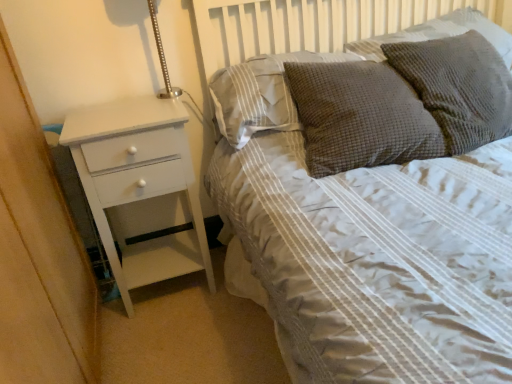
Question: Is brown textured pillow at upper right, which is the 3th pillow in right-to-left order, placed right next to white painted wood chest of drawers at left?

Choices:
 (A) yes
 (B) no

Answer: (B)

Question: Can we say brown textured pillow at upper right, placed as the 2th pillow when sorted from left to right, lies outside white painted wood chest of drawers at left?

Choices:
 (A) no
 (B) yes

Answer: (B)

Question: Considering the relative sizes of brown textured pillow at upper right, placed as the 2th pillow when sorted from left to right, and white painted wood chest of drawers at left in the image provided, is brown textured pillow at upper right, placed as the 2th pillow when sorted from left to right, smaller than white painted wood chest of drawers at left?

Choices:
 (A) no
 (B) yes

Answer: (B)

Question: Is brown textured pillow at upper right, which is the 3th pillow in right-to-left order, oriented towards white painted wood chest of drawers at left?

Choices:
 (A) no
 (B) yes

Answer: (A)

Question: From the image's perspective, is brown textured pillow at upper right, placed as the 2th pillow when sorted from left to right, on top of white painted wood chest of drawers at left?

Choices:
 (A) yes
 (B) no

Answer: (A)

Question: Does brown textured pillow at upper right, which is the 3th pillow in right-to-left order, have a lesser height compared to white painted wood chest of drawers at left?

Choices:
 (A) no
 (B) yes

Answer: (B)

Question: Is textured gray pillow at upper right, the 4th pillow viewed from the left, behind textured gray pillow at upper right, positioned as the 3th pillow in left-to-right order?

Choices:
 (A) yes
 (B) no

Answer: (A)

Question: From the image's perspective, is textured gray pillow at upper right, the 1th pillow when ordered from right to left, over textured gray pillow at upper right, positioned as the 3th pillow in left-to-right order?

Choices:
 (A) no
 (B) yes

Answer: (B)

Question: Is textured gray pillow at upper right, the 4th pillow viewed from the left, positioned in front of textured gray pillow at upper right, positioned as the 3th pillow in left-to-right order?

Choices:
 (A) yes
 (B) no

Answer: (B)

Question: Can you see textured gray pillow at upper right, the 1th pillow when ordered from right to left, touching textured gray pillow at upper right, positioned as the 3th pillow in left-to-right order?

Choices:
 (A) no
 (B) yes

Answer: (A)

Question: Is textured gray pillow at upper right, the 1th pillow when ordered from right to left, facing towards textured gray pillow at upper right, positioned as the 3th pillow in left-to-right order?

Choices:
 (A) no
 (B) yes

Answer: (B)

Question: Would you say textured gray pillow at upper right, the 1th pillow when ordered from right to left, is a long distance from textured gray pillow at upper right, positioned as the 3th pillow in left-to-right order?

Choices:
 (A) yes
 (B) no

Answer: (B)

Question: Is white painted wood chest of drawers at left to the left of textured gray pillow at upper right, the 1th pillow when ordered from right to left, from the viewer's perspective?

Choices:
 (A) no
 (B) yes

Answer: (B)